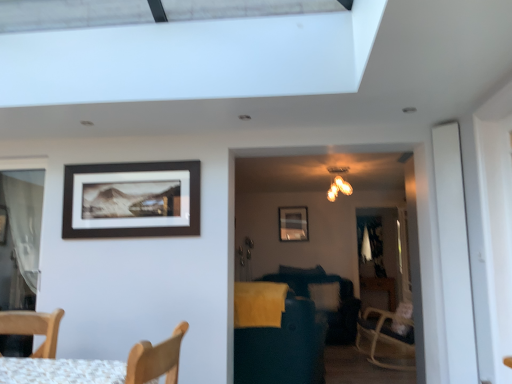
Question: Is white glossy screen door at right taller or shorter than matte black picture frame at upper center, positioned as the 1th picture frame in top-to-bottom order?

Choices:
 (A) short
 (B) tall

Answer: (B)

Question: From the image's perspective, is white glossy screen door at right above or below matte black picture frame at upper center, marked as the 1th picture frame in a front-to-back arrangement?

Choices:
 (A) below
 (B) above

Answer: (A)

Question: Estimate the real-world distances between objects in this image. Which object is closer to the dark blue fabric swivel chair at center?

Choices:
 (A) matte black picture frame at upper center, which is the 2th picture frame from right to left
 (B) matte black picture frame at upper center, positioned as the 2th picture frame in front-to-back order
 (C) matte gold chandelier at upper center
 (D) white fabric pillow at center
 (E) white glossy screen door at right

Answer: (A)

Question: Which of these objects is positioned closest to the matte gold chandelier at upper center?

Choices:
 (A) matte black picture frame at upper center, the 1th picture frame viewed from the left
 (B) white glossy screen door at right
 (C) dark blue fabric swivel chair at center
 (D) white fabric pillow at center
 (E) matte black picture frame at upper center, positioned as the 1th picture frame in back-to-front order

Answer: (E)